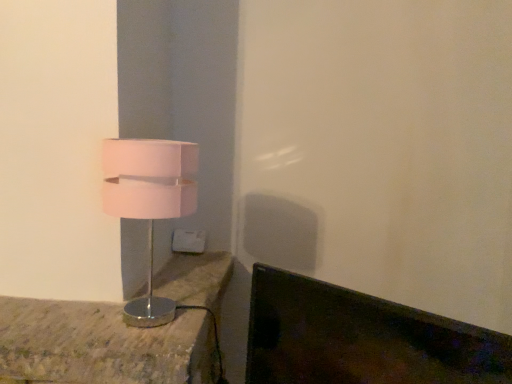
Question: Can you confirm if metallic silver lamp at left is wider than white plastic electric outlet at center?

Choices:
 (A) yes
 (B) no

Answer: (A)

Question: Considering the relative sizes of metallic silver lamp at left and white plastic electric outlet at center in the image provided, is metallic silver lamp at left shorter than white plastic electric outlet at center?

Choices:
 (A) yes
 (B) no

Answer: (B)

Question: From the image's perspective, is metallic silver lamp at left located above white plastic electric outlet at center?

Choices:
 (A) yes
 (B) no

Answer: (B)

Question: Is metallic silver lamp at left completely or partially outside of white plastic electric outlet at center?

Choices:
 (A) no
 (B) yes

Answer: (B)

Question: Is metallic silver lamp at left further to the viewer compared to white plastic electric outlet at center?

Choices:
 (A) no
 (B) yes

Answer: (A)

Question: Looking at their shapes, would you say pink matte lampshade at left is wider or thinner than metallic silver lamp at left?

Choices:
 (A) thin
 (B) wide

Answer: (A)

Question: Choose the correct answer: Is pink matte lampshade at left inside metallic silver lamp at left or outside it?

Choices:
 (A) outside
 (B) inside

Answer: (A)

Question: Is point (123, 157) closer or farther from the camera than point (212, 251)?

Choices:
 (A) closer
 (B) farther

Answer: (A)

Question: Visually, is pink matte lampshade at left positioned to the left or to the right of metallic silver lamp at left?

Choices:
 (A) right
 (B) left

Answer: (A)

Question: Is pink matte lampshade at left in front of or behind white plastic electric outlet at center in the image?

Choices:
 (A) front
 (B) behind

Answer: (A)

Question: Considering the relative positions of pink matte lampshade at left and white plastic electric outlet at center in the image provided, is pink matte lampshade at left to the left or to the right of white plastic electric outlet at center?

Choices:
 (A) left
 (B) right

Answer: (A)

Question: From a real-world perspective, is pink matte lampshade at left above or below white plastic electric outlet at center?

Choices:
 (A) above
 (B) below

Answer: (A)

Question: Is pink matte lampshade at left inside the boundaries of white plastic electric outlet at center, or outside?

Choices:
 (A) outside
 (B) inside

Answer: (A)

Question: In terms of size, does white plastic electric outlet at center appear bigger or smaller than pink matte lampshade at left?

Choices:
 (A) small
 (B) big

Answer: (A)

Question: Is white plastic electric outlet at center to the left or to the right of pink matte lampshade at left in the image?

Choices:
 (A) left
 (B) right

Answer: (B)